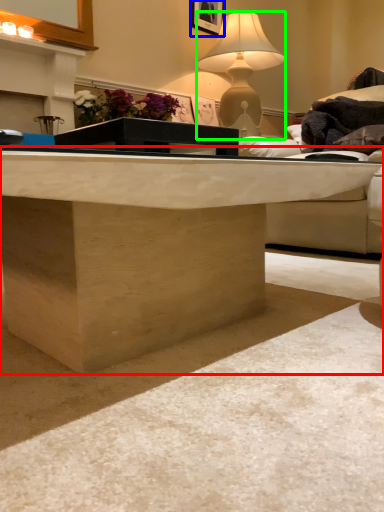
Question: Which object is positioned closest to desk (highlighted by a red box)? Select from picture frame (highlighted by a blue box) and lamp (highlighted by a green box).

Choices:
 (A) picture frame
 (B) lamp

Answer: (B)